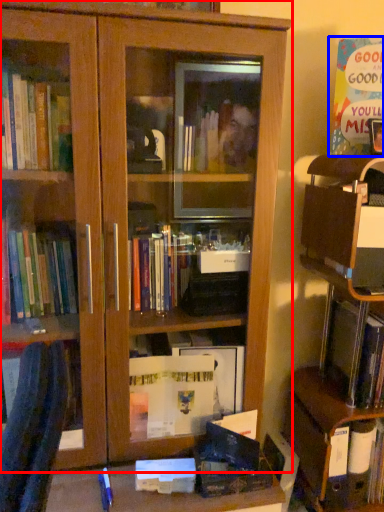
Question: Which point is closer to the camera, bookcase (highlighted by a red box) or paperback book (highlighted by a blue box)?

Choices:
 (A) bookcase
 (B) paperback book

Answer: (A)